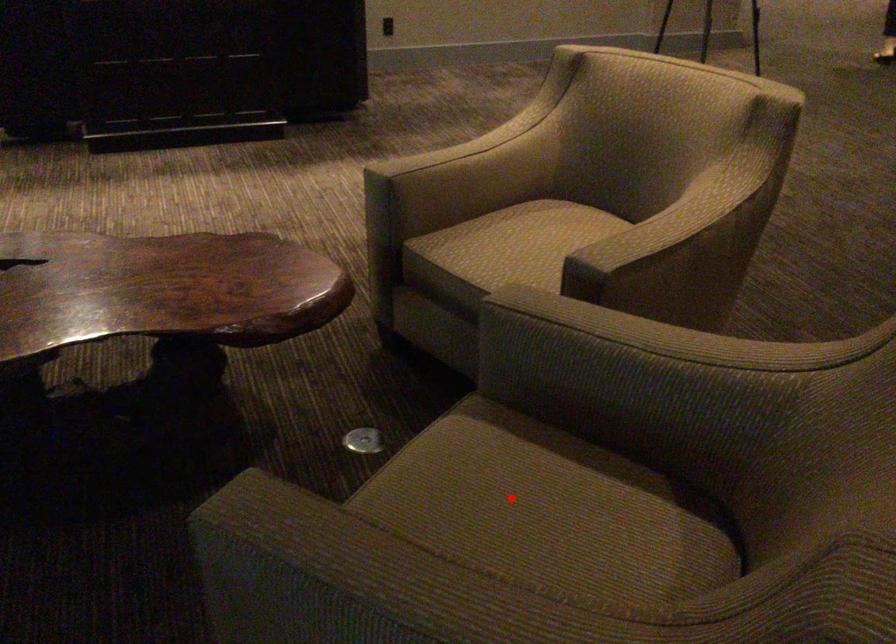
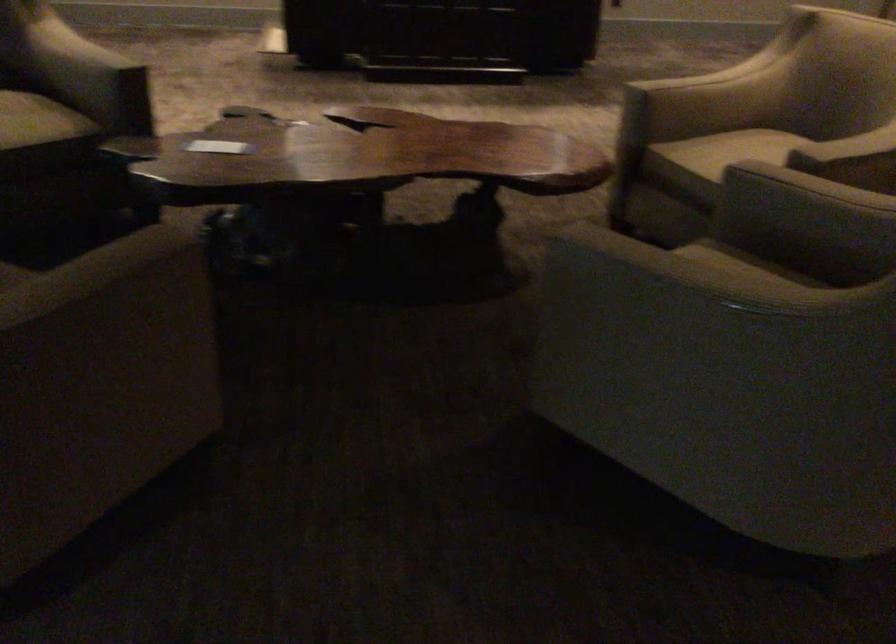
Question: I am providing you with two images of the same scene from different viewpoints. A red point is marked on the first image. Can you still see the location of the red point in image 2?

Choices:
 (A) Yes
 (B) No

Answer: (B)